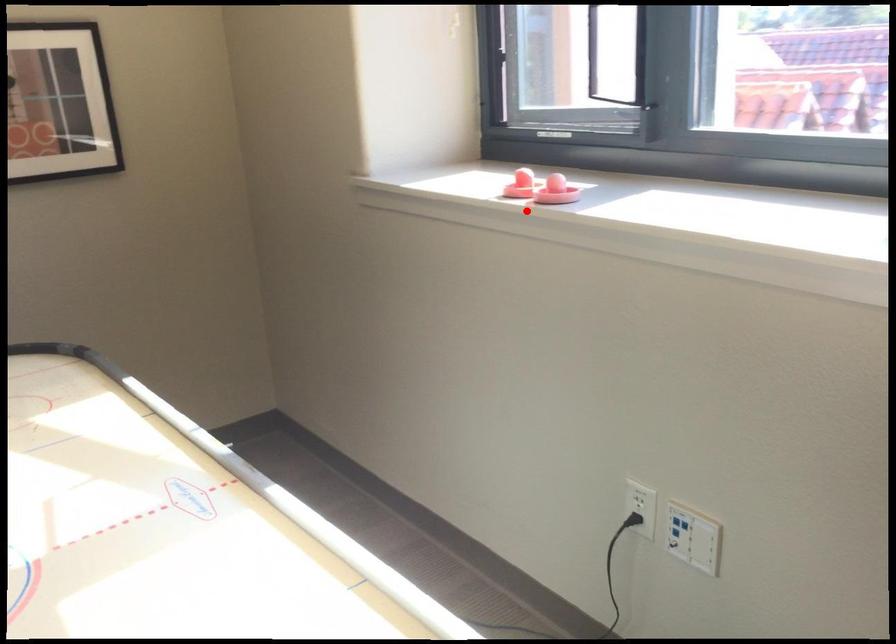
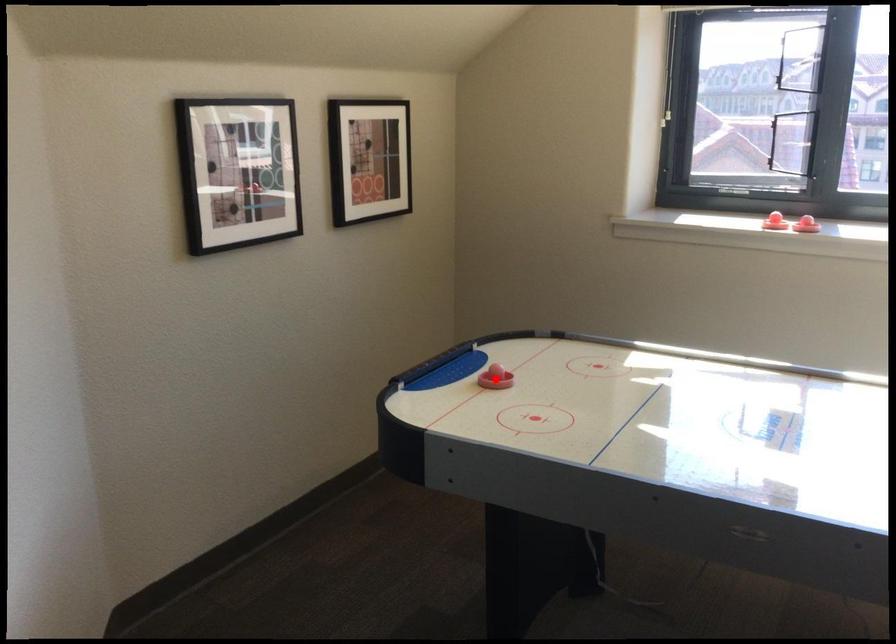
I am providing you with two images of the same scene from different viewpoints. A red point is marked on the first image and another point is marked on the second image. Do the highlighted points in image1 and image2 indicate the same real-world spot?

No